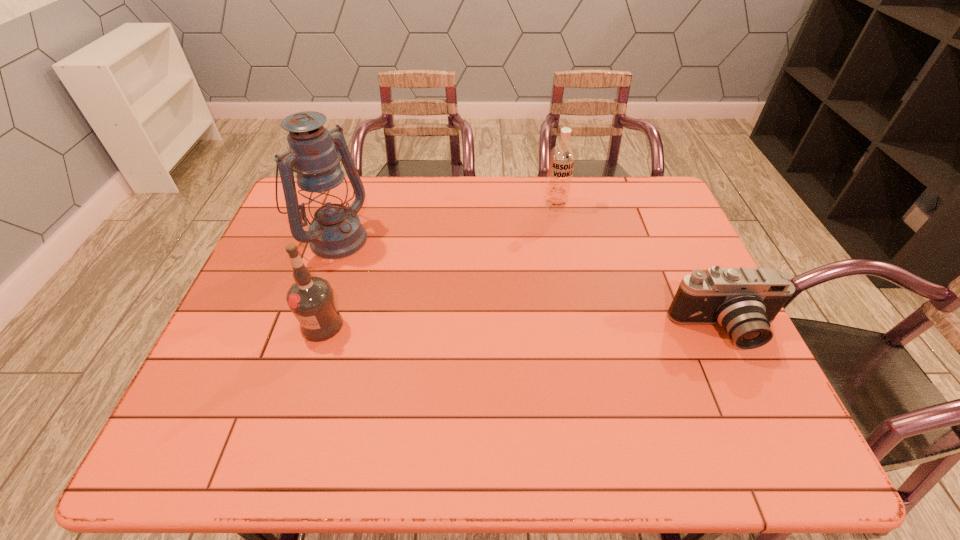
At what (x,y) coordinates should I click in order to perform the action: click on the nearer vodka. Please return your answer as a coordinate pair (x, y). Looking at the image, I should click on (311, 299).

In order to click on the shortest object in this screenshot , I will do `click(744, 301)`.

Image resolution: width=960 pixels, height=540 pixels. I want to click on camera, so click(x=744, y=301).

I want to click on the tallest object, so click(x=315, y=153).

What are the coordinates of `the third nearest object` in the screenshot? It's located at (315, 153).

I want to click on the second object from right to left, so click(562, 157).

Find the location of a particular element. The width and height of the screenshot is (960, 540). the farthest object is located at coordinates (562, 157).

You are a GUI agent. You are given a task and a screenshot of the screen. Output one action in this format:
    pyautogui.click(x=<x>, y=<y>)
    Task: Click on the free space located 0.060m on the front label of the left vodka
    
    Given the screenshot: What is the action you would take?
    pyautogui.click(x=310, y=363)

Image resolution: width=960 pixels, height=540 pixels. Identify the location of free space located on the front-facing side of the shortest object. (746, 375).

Find the location of a particular element. free space located 0.170m on the front-facing side of the tallest object is located at coordinates (398, 278).